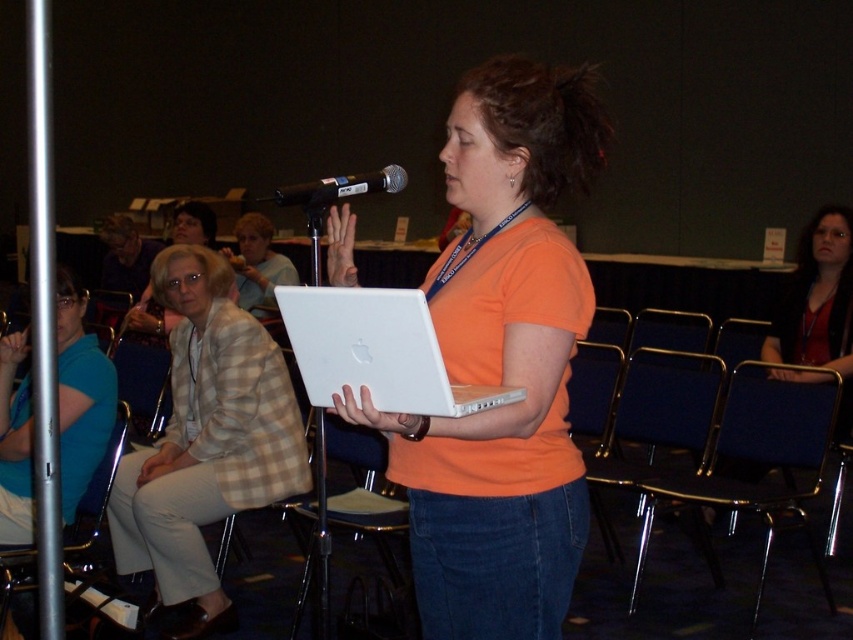
Is plastic chair at lower left wider than black plastic microphone at center?

Yes.

Is plastic chair at lower left bigger than black plastic microphone at center?

Yes, plastic chair at lower left is bigger than black plastic microphone at center.

Image resolution: width=853 pixels, height=640 pixels. In order to click on plastic chair at lower left in this screenshot , I will do `click(143, 381)`.

Is orange matte shirt at center bigger than white plastic laptop at center?

Indeed, orange matte shirt at center has a larger size compared to white plastic laptop at center.

Is orange matte shirt at center to the left of white plastic laptop at center from the viewer's perspective?

In fact, orange matte shirt at center is to the right of white plastic laptop at center.

Who is more forward, (485, 589) or (358, 326)?

Point (358, 326) is more forward.

Identify the location of orange matte shirt at center. The height and width of the screenshot is (640, 853). (502, 362).

This screenshot has height=640, width=853. Describe the element at coordinates (376, 352) in the screenshot. I see `white plastic laptop at center` at that location.

Is point (419, 310) in front of point (749, 449)?

Yes, point (419, 310) is closer to viewer.

Locate an element on the screen. The width and height of the screenshot is (853, 640). white plastic laptop at center is located at coordinates (376, 352).